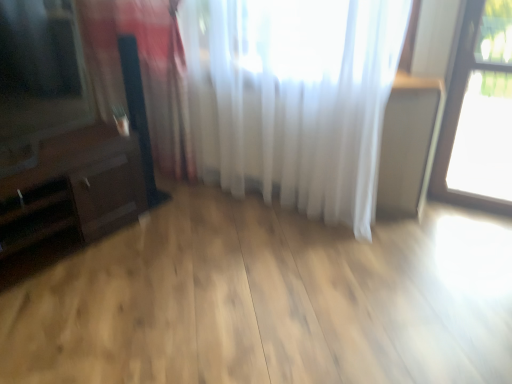
Question: Is the position of white sheer curtain at upper center, placed as the 1th curtain when sorted from right to left, more distant than that of dark brown wood dresser at left?

Choices:
 (A) yes
 (B) no

Answer: (A)

Question: Considering the relative sizes of white sheer curtain at upper center, the 2th curtain in the left-to-right sequence, and dark brown wood dresser at left in the image provided, is white sheer curtain at upper center, the 2th curtain in the left-to-right sequence, shorter than dark brown wood dresser at left?

Choices:
 (A) yes
 (B) no

Answer: (B)

Question: Is white sheer curtain at upper center, placed as the 1th curtain when sorted from right to left, thinner than dark brown wood dresser at left?

Choices:
 (A) yes
 (B) no

Answer: (A)

Question: From a real-world perspective, is white sheer curtain at upper center, the 2th curtain in the left-to-right sequence, positioned under dark brown wood dresser at left based on gravity?

Choices:
 (A) no
 (B) yes

Answer: (A)

Question: Is white sheer curtain at upper center, placed as the 1th curtain when sorted from right to left, positioned before dark brown wood dresser at left?

Choices:
 (A) yes
 (B) no

Answer: (B)

Question: Is white sheer curtain at upper center, the 2th curtain in the left-to-right sequence, spatially inside matte black tv at left, or outside of it?

Choices:
 (A) inside
 (B) outside

Answer: (B)

Question: From a real-world perspective, is white sheer curtain at upper center, placed as the 1th curtain when sorted from right to left, physically located above or below matte black tv at left?

Choices:
 (A) above
 (B) below

Answer: (B)

Question: Is white sheer curtain at upper center, the 2th curtain in the left-to-right sequence, in front of or behind matte black tv at left in the image?

Choices:
 (A) front
 (B) behind

Answer: (B)

Question: In terms of size, does white sheer curtain at upper center, the 2th curtain in the left-to-right sequence, appear bigger or smaller than matte black tv at left?

Choices:
 (A) big
 (B) small

Answer: (A)

Question: From a real-world perspective, is matte black tv at left above or below white sheer curtain at left, which is the first curtain in left-to-right order?

Choices:
 (A) above
 (B) below

Answer: (A)

Question: From the image's perspective, relative to white sheer curtain at left, which is the first curtain in left-to-right order, is matte black tv at left above or below?

Choices:
 (A) below
 (B) above

Answer: (B)

Question: Is matte black tv at left taller or shorter than white sheer curtain at left, the 2th curtain in the right-to-left sequence?

Choices:
 (A) short
 (B) tall

Answer: (A)

Question: Would you say matte black tv at left is to the left or to the right of white sheer curtain at left, the 2th curtain in the right-to-left sequence, in the picture?

Choices:
 (A) left
 (B) right

Answer: (A)

Question: Is transparent glass window at upper right to the left or to the right of white sheer curtain at left, the 2th curtain in the right-to-left sequence, in the image?

Choices:
 (A) right
 (B) left

Answer: (A)

Question: In terms of size, does transparent glass window at upper right appear bigger or smaller than white sheer curtain at left, which is the first curtain in left-to-right order?

Choices:
 (A) small
 (B) big

Answer: (A)